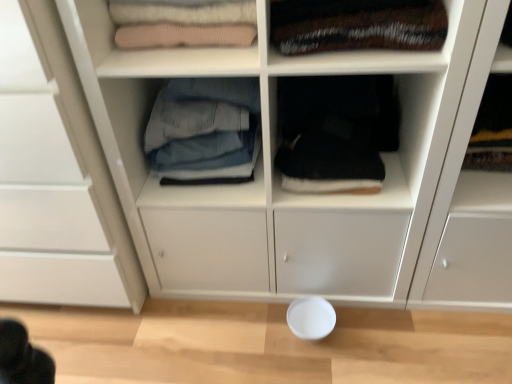
This screenshot has height=384, width=512. I want to click on free location to the left of white matte bowl at lower center, so click(252, 334).